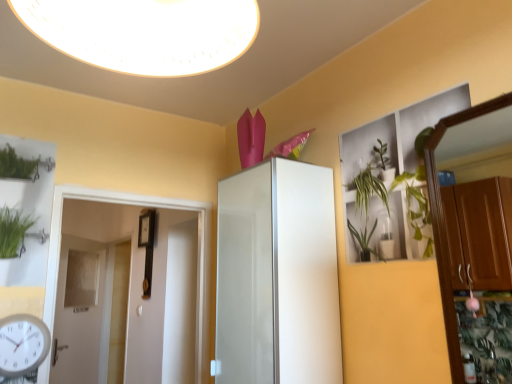
Find the location of a particular element. wooden dresser at right is located at coordinates (475, 235).

Describe the element at coordinates (82, 312) in the screenshot. Image resolution: width=512 pixels, height=384 pixels. I see `white glossy door at left, which is counted as the 2th door, starting from the right` at that location.

This screenshot has height=384, width=512. Describe the element at coordinates (140, 206) in the screenshot. I see `white glossy door at left, marked as the 1th door in a right-to-left arrangement` at that location.

Image resolution: width=512 pixels, height=384 pixels. Find the location of `white glossy light fixture at upper center`. white glossy light fixture at upper center is located at coordinates (145, 32).

Can you confirm if white glossy door at left, positioned as the 2th door in left-to-right order, is smaller than wooden dresser at right?

Actually, white glossy door at left, positioned as the 2th door in left-to-right order, might be larger than wooden dresser at right.

Are white glossy door at left, positioned as the 2th door in left-to-right order, and wooden dresser at right far apart?

Absolutely, white glossy door at left, positioned as the 2th door in left-to-right order, is distant from wooden dresser at right.

How different are the orientations of white glossy door at left, positioned as the second door in back-to-front order, and wooden dresser at right in degrees?

They differ by 89.3 degrees in their facing directions.

Where is `dresser above the white glossy door at left, positioned as the 2th door in left-to-right order (from the image's perspective)`? The width and height of the screenshot is (512, 384). dresser above the white glossy door at left, positioned as the 2th door in left-to-right order (from the image's perspective) is located at coordinates [475, 235].

Looking at this image, is wooden dresser at right in front of or behind white glossy door at left, positioned as the second door in back-to-front order, in the image?

Clearly, wooden dresser at right is in front of white glossy door at left, positioned as the second door in back-to-front order.

Identify the location of the 1st door below the wooden dresser at right (from a real-world perspective). The width and height of the screenshot is (512, 384). click(140, 206).

Would you say wooden dresser at right is outside white glossy door at left, marked as the 1th door in a right-to-left arrangement?

Yes, wooden dresser at right is not within white glossy door at left, marked as the 1th door in a right-to-left arrangement.

Considering the points (321, 170) and (199, 72), which point is in front, point (321, 170) or point (199, 72)?

The point (199, 72) is closer to the camera.

From a real-world perspective, is white glossy cabinet at center beneath white glossy light fixture at upper center?

Indeed, from a real-world perspective, white glossy cabinet at center is positioned beneath white glossy light fixture at upper center.

How many degrees apart are the facing directions of white glossy cabinet at center and white glossy light fixture at upper center?

There is a 91-degree angle between the facing directions of white glossy cabinet at center and white glossy light fixture at upper center.

Which object is positioned more to the right, white glossy cabinet at center or white glossy light fixture at upper center?

white glossy cabinet at center is more to the right.

Is white glossy door at left, positioned as the 2th door in left-to-right order, shorter than white plastic clock at lower left?

In fact, white glossy door at left, positioned as the 2th door in left-to-right order, may be taller than white plastic clock at lower left.

How different are the orientations of white glossy door at left, positioned as the 2th door in left-to-right order, and white plastic clock at lower left in degrees?

0.73 degrees.

Is white glossy door at left, positioned as the 2th door in left-to-right order, completely or partially outside of white plastic clock at lower left?

Yes, white glossy door at left, positioned as the 2th door in left-to-right order, is not within white plastic clock at lower left.

From a real-world perspective, which object stands above the other?

From a 3D spatial view, white glossy door at left, positioned as the second door in back-to-front order, is above.

Who is smaller, white plastic clock at lower left or white glossy door at left, positioned as the 1th door in front-to-back order?

With smaller size is white plastic clock at lower left.

Is point (41, 356) positioned before point (53, 316)?

That is True.

Measure the distance from white plastic clock at lower left to white glossy door at left, positioned as the 1th door in front-to-back order.

The distance of white plastic clock at lower left from white glossy door at left, positioned as the 1th door in front-to-back order, is 10.73 inches.

From a real-world perspective, is white plastic clock at lower left physically located above or below white glossy door at left, positioned as the second door in back-to-front order?

Clearly, from a real-world perspective, white plastic clock at lower left is below white glossy door at left, positioned as the second door in back-to-front order.

Would you say white glossy door at left, positioned as the 1th door in front-to-back order, is inside or outside white glossy door at left, which is the 1th door in back-to-front order?

white glossy door at left, positioned as the 1th door in front-to-back order, lies outside white glossy door at left, which is the 1th door in back-to-front order.

From the image's perspective, who appears lower, white glossy door at left, positioned as the 1th door in front-to-back order, or white glossy door at left, positioned as the 2th door in front-to-back order?

white glossy door at left, positioned as the 2th door in front-to-back order.

Considering the sizes of objects white glossy door at left, positioned as the 2th door in left-to-right order, and white glossy door at left, positioned as the first door in left-to-right order, in the image provided, who is bigger, white glossy door at left, positioned as the 2th door in left-to-right order, or white glossy door at left, positioned as the first door in left-to-right order,?

white glossy door at left, positioned as the first door in left-to-right order, is bigger.

This screenshot has width=512, height=384. What are the coordinates of `door to the left of white glossy door at left, marked as the 1th door in a right-to-left arrangement` in the screenshot? It's located at (82, 312).

From a real-world perspective, is wooden dresser at right above or below white glossy light fixture at upper center?

In terms of real-world spatial position, wooden dresser at right is below white glossy light fixture at upper center.

Can you confirm if wooden dresser at right is bigger than white glossy light fixture at upper center?

No.

Considering the positions of objects wooden dresser at right and white glossy light fixture at upper center in the image provided, who is more to the left, wooden dresser at right or white glossy light fixture at upper center?

Positioned to the left is white glossy light fixture at upper center.

At what (x,y) coordinates should I click in order to perform the action: click on light fixture above the wooden dresser at right (from a real-world perspective). Please return your answer as a coordinate pair (x, y). This screenshot has height=384, width=512. Looking at the image, I should click on (145, 32).

This screenshot has height=384, width=512. There is a wooden dresser at right. In order to click on the 1st door below it (from a real-world perspective) in this screenshot , I will do `click(140, 206)`.

Starting from the wooden dresser at right, which door is the 1st one to the left? Please provide its 2D coordinates.

[(140, 206)]

Which object lies further to the anchor point white glossy door at left, positioned as the 2th door in left-to-right order, wooden dresser at right or white glossy door at left, which is the 1th door in back-to-front order?

Based on the image, white glossy door at left, which is the 1th door in back-to-front order, appears to be further to white glossy door at left, positioned as the 2th door in left-to-right order.

From the image, which object appears to be farther from white glossy door at left, marked as the 1th door in a right-to-left arrangement, white glossy cabinet at center or wooden dresser at right?

wooden dresser at right.

From the image, which object appears to be nearer to white glossy door at left, positioned as the second door in back-to-front order, wooden dresser at right or white plastic clock at lower left?

white plastic clock at lower left.

Which object lies nearer to the anchor point white glossy door at left, positioned as the first door in left-to-right order, white plastic clock at lower left or white glossy light fixture at upper center?

white plastic clock at lower left.

Looking at the image, which one is located further to white plastic clock at lower left, white glossy door at left, positioned as the 1th door in front-to-back order, or white glossy light fixture at upper center?

white glossy light fixture at upper center.

Based on their spatial positions, is white plastic clock at lower left or white glossy door at left, positioned as the first door in left-to-right order, closer to white glossy cabinet at center?

white plastic clock at lower left is positioned closer to the anchor white glossy cabinet at center.

Estimate the real-world distances between objects in this image. Which object is further from white plastic clock at lower left, white glossy light fixture at upper center or white glossy door at left, positioned as the 2th door in front-to-back order?

white glossy door at left, positioned as the 2th door in front-to-back order, is further to white plastic clock at lower left.

Looking at the image, which one is located closer to white glossy cabinet at center, white glossy door at left, which is counted as the 2th door, starting from the right, or white glossy door at left, marked as the 1th door in a right-to-left arrangement?

white glossy door at left, marked as the 1th door in a right-to-left arrangement, lies closer to white glossy cabinet at center than the other object.

Locate an element on the screen. The image size is (512, 384). dresser located between white glossy light fixture at upper center and white glossy door at left, positioned as the 2th door in left-to-right order, in the depth direction is located at coordinates (475, 235).

Locate an element on the screen. This screenshot has width=512, height=384. door between white plastic clock at lower left and white glossy cabinet at center is located at coordinates (140, 206).

The height and width of the screenshot is (384, 512). I want to click on light fixture between white plastic clock at lower left and wooden dresser at right in the horizontal direction, so click(145, 32).

The height and width of the screenshot is (384, 512). In order to click on door between white glossy light fixture at upper center and white glossy door at left, positioned as the first door in left-to-right order, along the z-axis in this screenshot , I will do `click(140, 206)`.